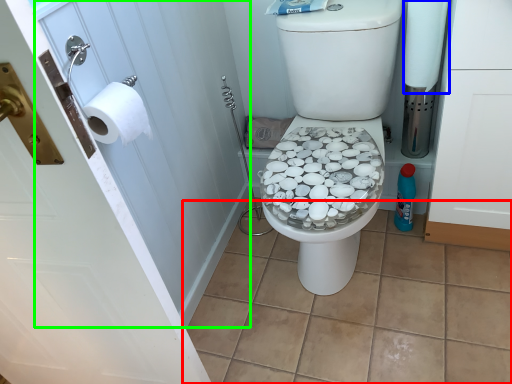
Question: Which object is the closest to the tile (highlighted by a red box)? Choose among these: toilet paper (highlighted by a blue box) or screen door (highlighted by a green box).

Choices:
 (A) toilet paper
 (B) screen door

Answer: (B)